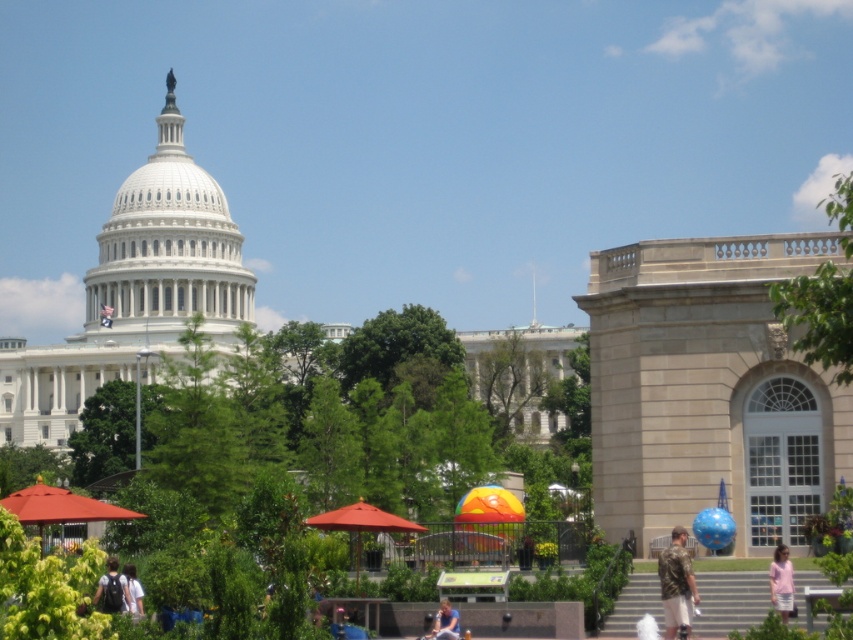
Question: Which point is closer to the camera taking this photo?

Choices:
 (A) [x=674, y=586]
 (B) [x=808, y=280]
 (C) [x=770, y=570]

Answer: (B)

Question: Is green leafy tree at upper right smaller than light brown hair at lower left?

Choices:
 (A) no
 (B) yes

Answer: (A)

Question: Is green leafy tree at center above dark gray backpack at lower left?

Choices:
 (A) yes
 (B) no

Answer: (A)

Question: Among these points, which one is farthest from the camera?

Choices:
 (A) (131, 563)
 (B) (450, 616)
 (C) (103, 596)

Answer: (A)

Question: Which point is closer to the camera taking this photo?

Choices:
 (A) (132, 467)
 (B) (126, 586)

Answer: (B)

Question: From the image, what is the correct spatial relationship of green leafy tree at center in relation to pink cotton shirt at lower right?

Choices:
 (A) right
 (B) left

Answer: (B)